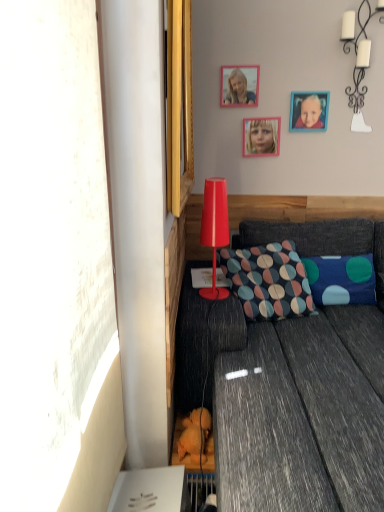
Question: Can you confirm if matte pink frame at upper center is positioned to the right of wooden picture frame at upper right, which is the first picture frame from right to left?

Choices:
 (A) no
 (B) yes

Answer: (A)

Question: Is the position of matte pink frame at upper center less distant than that of wooden picture frame at upper right, positioned as the second picture frame in left-to-right order?

Choices:
 (A) no
 (B) yes

Answer: (B)

Question: Is matte pink frame at upper center taller than wooden picture frame at upper right, which is the first picture frame from right to left?

Choices:
 (A) no
 (B) yes

Answer: (B)

Question: Can wooden picture frame at upper right, which is the first picture frame from right to left, be found inside matte pink frame at upper center?

Choices:
 (A) yes
 (B) no

Answer: (B)

Question: Is matte pink frame at upper center bigger than wooden picture frame at upper right, which is the first picture frame from right to left?

Choices:
 (A) yes
 (B) no

Answer: (A)

Question: Considering the positions of wooden picture frame at upper center, which ranks as the 2th picture frame in right-to-left order, and multicolored fabric pillow at center, which is counted as the 1th pillow, starting from the left, in the image, is wooden picture frame at upper center, which ranks as the 2th picture frame in right-to-left order, taller or shorter than multicolored fabric pillow at center, which is counted as the 1th pillow, starting from the left,?

Choices:
 (A) tall
 (B) short

Answer: (B)

Question: Relative to multicolored fabric pillow at center, the second pillow from the right, is wooden picture frame at upper center, which ranks as the 2th picture frame in right-to-left order, in front or behind?

Choices:
 (A) behind
 (B) front

Answer: (A)

Question: Looking at the image, does wooden picture frame at upper center, which ranks as the 2th picture frame in right-to-left order, seem bigger or smaller compared to multicolored fabric pillow at center, which is counted as the 1th pillow, starting from the left?

Choices:
 (A) big
 (B) small

Answer: (B)

Question: Visually, is wooden picture frame at upper center, which ranks as the 2th picture frame in right-to-left order, positioned to the left or to the right of multicolored fabric pillow at center, the second pillow from the right?

Choices:
 (A) right
 (B) left

Answer: (A)

Question: Is white ceramic candlestick at upper right, which ranks as the second lamp in front-to-back order, in front of or behind textured gray couch at lower right in the image?

Choices:
 (A) front
 (B) behind

Answer: (B)

Question: Is white ceramic candlestick at upper right, the 2th lamp from the bottom, bigger or smaller than textured gray couch at lower right?

Choices:
 (A) big
 (B) small

Answer: (B)

Question: Considering the relative positions of white ceramic candlestick at upper right, the 2th lamp from the bottom, and textured gray couch at lower right in the image provided, is white ceramic candlestick at upper right, the 2th lamp from the bottom, to the left or to the right of textured gray couch at lower right?

Choices:
 (A) left
 (B) right

Answer: (B)

Question: Considering the positions of point (367, 61) and point (352, 510), is point (367, 61) closer or farther from the camera than point (352, 510)?

Choices:
 (A) farther
 (B) closer

Answer: (A)

Question: In terms of size, does wooden picture frame at upper center, which appears as the 1th picture frame when viewed from the left, appear bigger or smaller than white ceramic candlestick at upper right, the 2th lamp from the bottom?

Choices:
 (A) big
 (B) small

Answer: (B)

Question: Do you think wooden picture frame at upper center, which appears as the 1th picture frame when viewed from the left, is within white ceramic candlestick at upper right, which is the 1th lamp from top to bottom, or outside of it?

Choices:
 (A) outside
 (B) inside

Answer: (A)